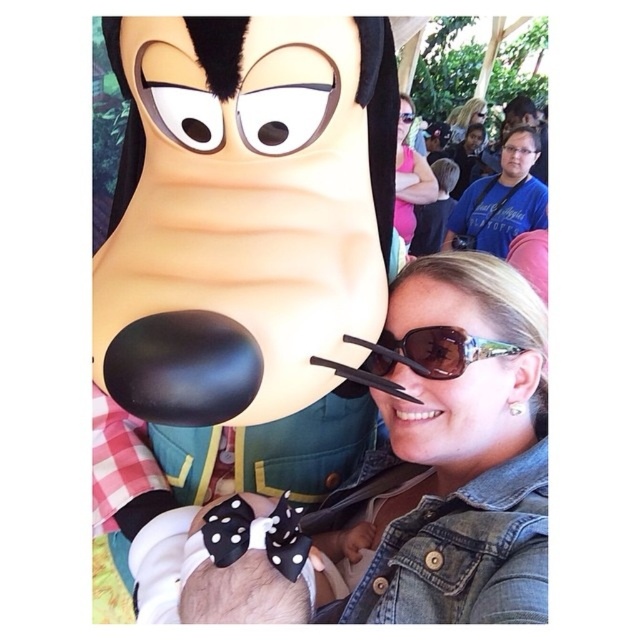
Between denim jacket at lower right and brown reflective sunglasses at upper right, which one has more height?

denim jacket at lower right is taller.

Can you confirm if denim jacket at lower right is bigger than brown reflective sunglasses at upper right?

Correct, denim jacket at lower right is larger in size than brown reflective sunglasses at upper right.

This screenshot has width=640, height=640. What do you see at coordinates (464, 451) in the screenshot?
I see `denim jacket at lower right` at bounding box center [464, 451].

Locate an element on the screen. The image size is (640, 640). denim jacket at lower right is located at coordinates tap(464, 451).

What do you see at coordinates (259, 564) in the screenshot? I see `black polka dot bow at center` at bounding box center [259, 564].

Find the location of a particular element. This screenshot has height=640, width=640. black polka dot bow at center is located at coordinates (259, 564).

Describe the element at coordinates (259, 564) in the screenshot. I see `black polka dot bow at center` at that location.

At what (x,y) coordinates should I click in order to perform the action: click on black polka dot bow at center. Please return your answer as a coordinate pair (x, y). This screenshot has width=640, height=640. Looking at the image, I should click on click(259, 564).

Can you confirm if black dotted fabric bow tie at lower center is positioned below brown reflective sunglasses at upper right?

Yes, black dotted fabric bow tie at lower center is below brown reflective sunglasses at upper right.

Is black dotted fabric bow tie at lower center to the right of brown reflective sunglasses at upper right from the viewer's perspective?

In fact, black dotted fabric bow tie at lower center is to the left of brown reflective sunglasses at upper right.

Is point (278, 554) farther from viewer compared to point (464, 349)?

No.

Identify the location of black dotted fabric bow tie at lower center. (227, 531).